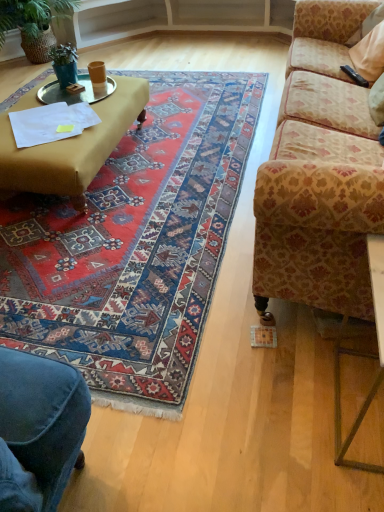
At what (x,y) coordinates should I click in order to perform the action: click on unoccupied area in front of green matte plant at upper left, which ranks as the second houseplant in left-to-right order. Please return your answer as a coordinate pair (x, y). The height and width of the screenshot is (512, 384). Looking at the image, I should click on (62, 94).